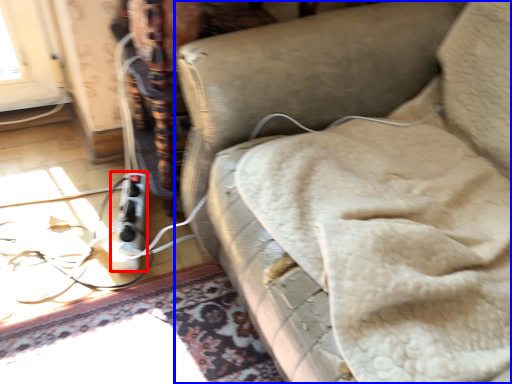
Question: Among these objects, which one is farthest to the camera, extension cord (highlighted by a red box) or furniture (highlighted by a blue box)?

Choices:
 (A) extension cord
 (B) furniture

Answer: (A)